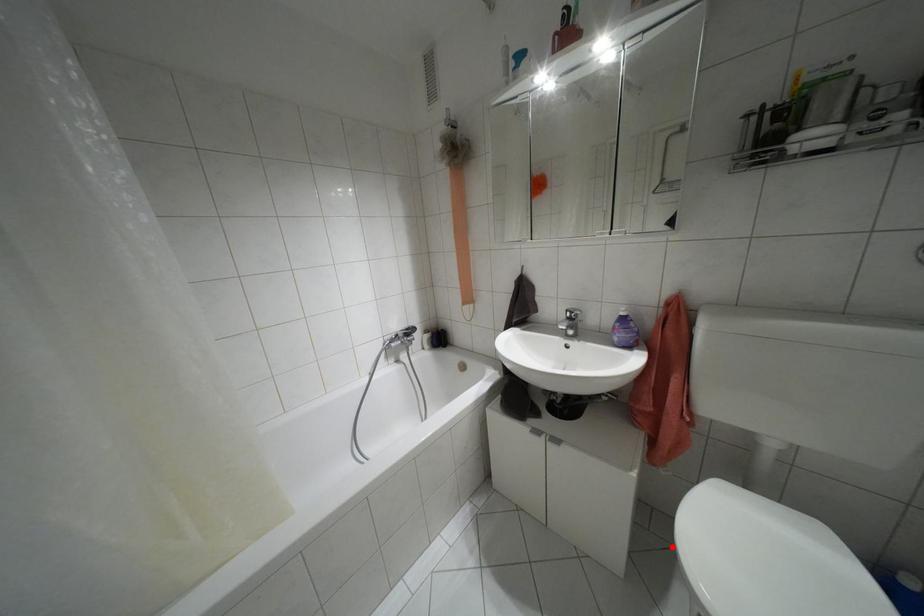
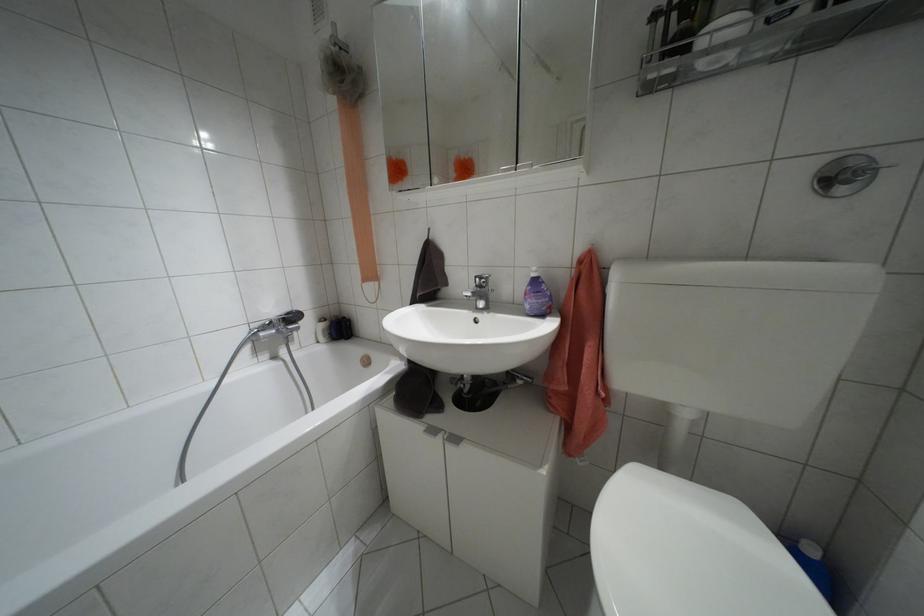
The point at the highlighted location is marked in the first image. Where is the corresponding point in the second image?

(590, 554)